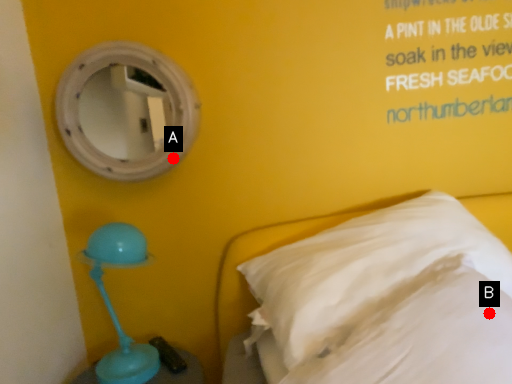
Question: Two points are circled on the image, labeled by A and B beside each circle. Which of the following is the closest to the observer?

Choices:
 (A) A is closer
 (B) B is closer

Answer: (B)